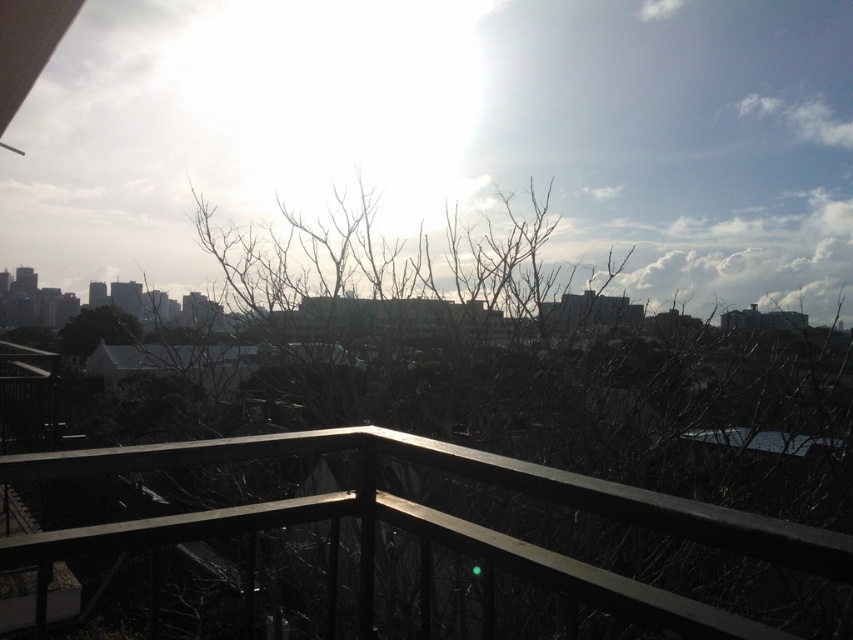
Which is more to the right, black metal balustrade at center or green matte tree at center?

black metal balustrade at center

Which of these two, black metal balustrade at center or green matte tree at center, stands shorter?

With less height is green matte tree at center.

Is point (714, 524) positioned in front of point (112, 308)?

Yes, point (714, 524) is in front of point (112, 308).

Locate an element on the screen. The width and height of the screenshot is (853, 640). black metal balustrade at center is located at coordinates (444, 520).